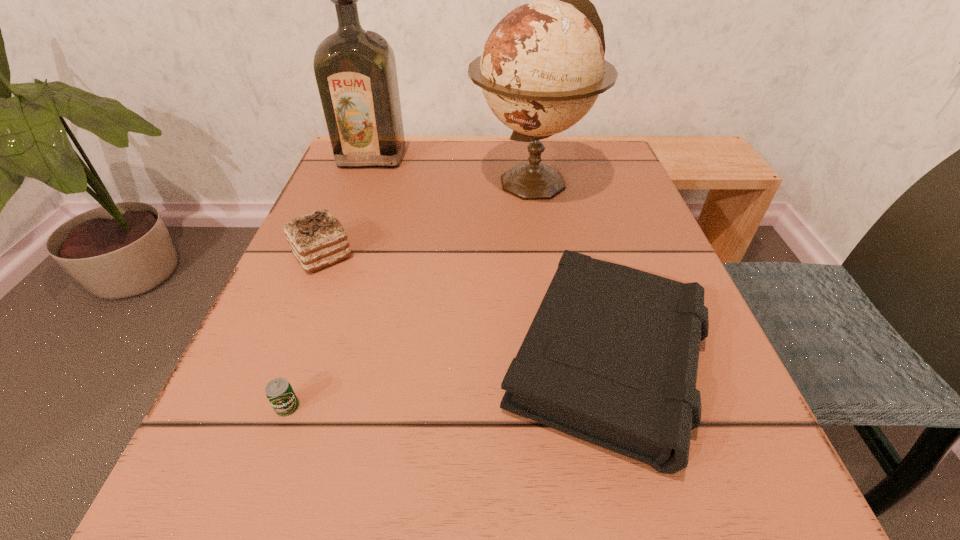
Locate an element on the screen. The width and height of the screenshot is (960, 540). vacant region between the globe and the third farthest object is located at coordinates [427, 218].

At what (x,y) coordinates should I click in order to perform the action: click on vacant area that lies between the globe and the liquor. Please return your answer as a coordinate pair (x, y). Image resolution: width=960 pixels, height=540 pixels. Looking at the image, I should click on point(452,169).

Locate an element on the screen. free space between the globe and the beer can is located at coordinates (410, 294).

What are the coordinates of `vacant space that is in between the liquor and the globe` in the screenshot? It's located at (452, 169).

Where is `empty space that is in between the liquor and the globe`? This screenshot has height=540, width=960. empty space that is in between the liquor and the globe is located at coordinates (452, 169).

Image resolution: width=960 pixels, height=540 pixels. I want to click on free space between the liquor and the Bible, so click(490, 259).

Identify the location of free space between the chocolate cake and the globe. This screenshot has height=540, width=960. (427, 218).

Identify the location of object that is the closest to the liquor. (542, 68).

Where is `object that is the closest to the shortest object`? object that is the closest to the shortest object is located at coordinates (611, 357).

Identify the location of vacant space that satisfies the following two spatial constraints: 1. on the label of the Bible; 2. on the right side of the liquor. (298, 361).